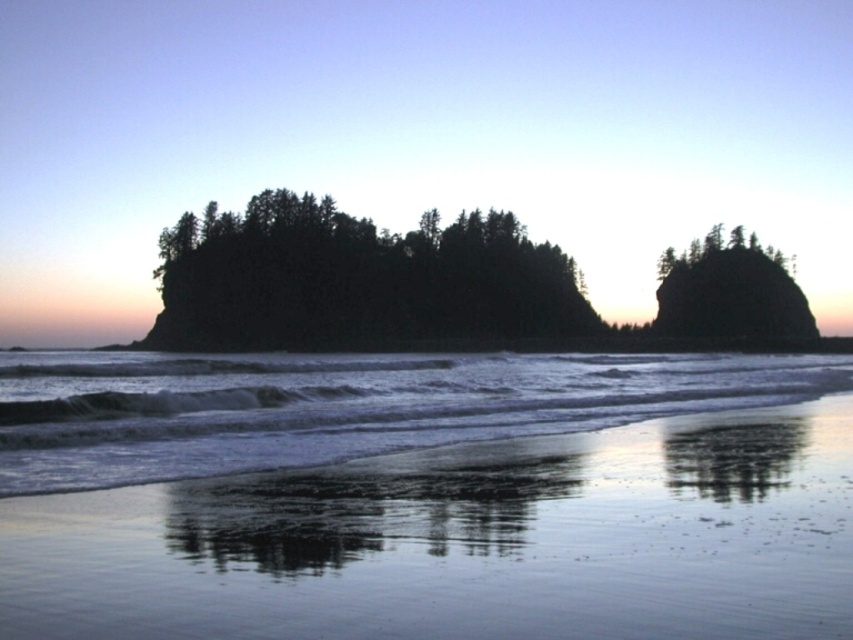
Between clear water at lower center and dark green forest at center, which one has more height?

dark green forest at center

Does clear water at lower center appear on the right side of dark green forest at center?

No, clear water at lower center is not to the right of dark green forest at center.

The width and height of the screenshot is (853, 640). Identify the location of clear water at lower center. (341, 404).